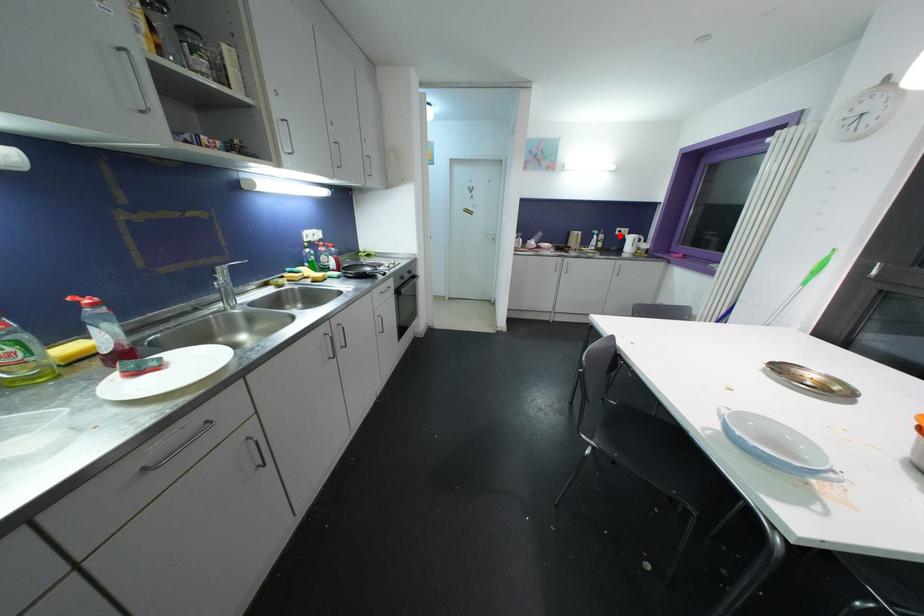
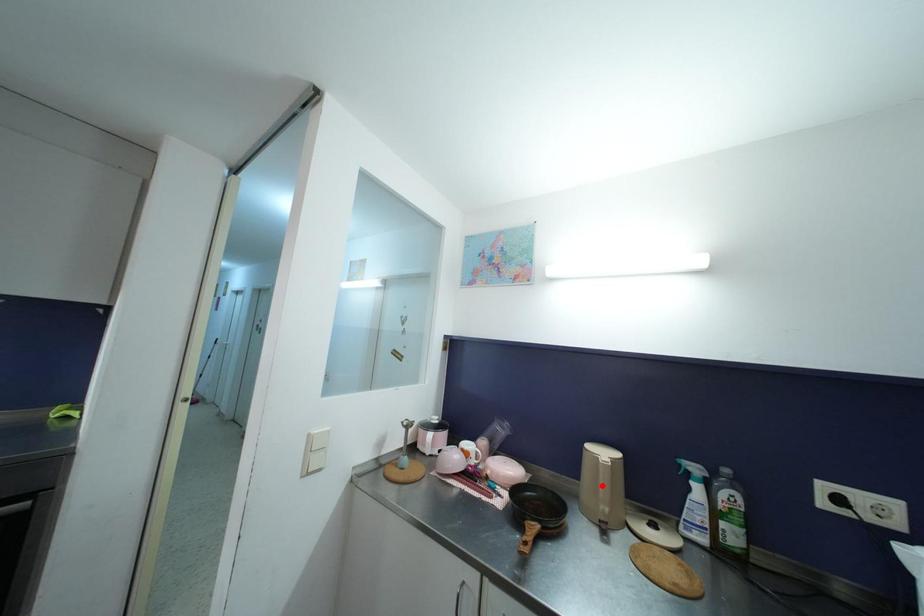
I am providing you with two images of the same scene from different viewpoints. A red point is marked on the first image and another point is marked on the second image. Is the red point in image1 aligned with the point shown in image2?

No